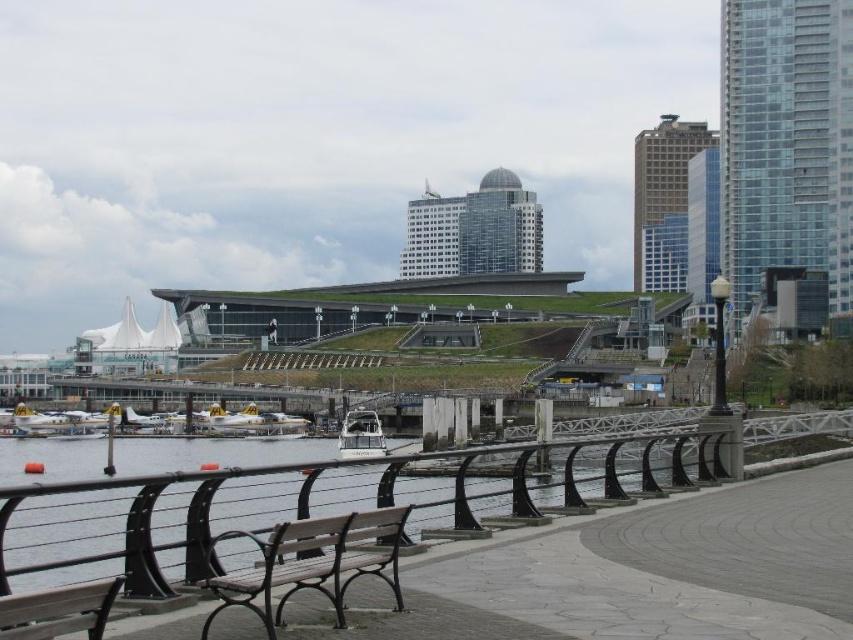
Does point (78, 513) come in front of point (235, 579)?

That is False.

Does black metal railing at lower left come in front of wooden bench at lower center?

That is False.

Describe the element at coordinates (126, 518) in the screenshot. I see `black metal railing at lower left` at that location.

I want to click on black metal railing at lower left, so click(x=126, y=518).

Between wooden bench at lower center and wooden bench at lower left, which one is positioned lower?

Positioned lower is wooden bench at lower center.

Is point (247, 605) positioned after point (86, 627)?

Yes.

Locate an element on the screen. This screenshot has height=640, width=853. wooden bench at lower center is located at coordinates (312, 563).

Which is more to the right, black metal railing at lower left or white glossy boat at center?

black metal railing at lower left is more to the right.

You are a GUI agent. You are given a task and a screenshot of the screen. Output one action in this format:
    pyautogui.click(x=<x>, y=<y>)
    Task: Click on the black metal railing at lower left
    
    Given the screenshot: What is the action you would take?
    [x=126, y=518]